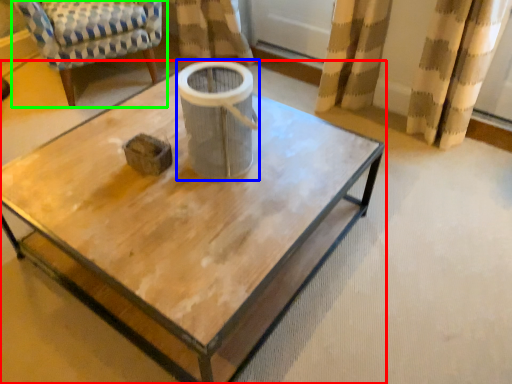
Question: Which object is the farthest from coffee table (highlighted by a red box)? Choose among these: gray (highlighted by a blue box) or chair (highlighted by a green box).

Choices:
 (A) gray
 (B) chair

Answer: (B)